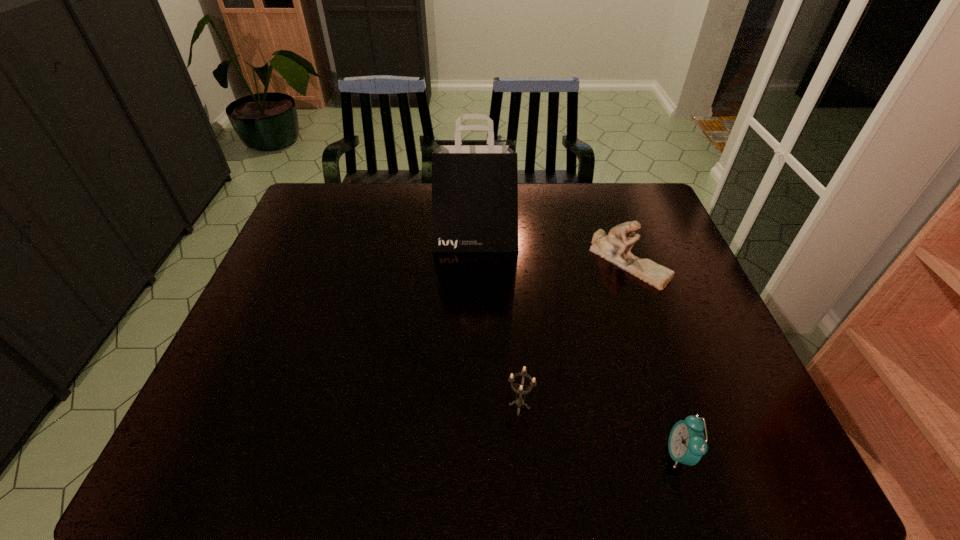
Locate an element on the screen. object located at the near edge is located at coordinates (687, 444).

Find the location of a particular element. This screenshot has height=540, width=960. object present at the right edge is located at coordinates (615, 247).

What are the coordinates of `free region at the far edge` in the screenshot? It's located at (362, 197).

The image size is (960, 540). I want to click on free space at the near edge, so click(x=361, y=467).

The width and height of the screenshot is (960, 540). In the image, there is a desktop. In order to click on vacant space at the left edge in this screenshot , I will do `click(261, 407)`.

Find the location of a particular element. vacant space at the right edge of the desktop is located at coordinates (668, 362).

Identify the location of vacant region at the near right corner of the desktop. Image resolution: width=960 pixels, height=540 pixels. (753, 454).

This screenshot has height=540, width=960. What are the coordinates of `empty location between the figurine and the shopping bag` in the screenshot? It's located at (552, 251).

Where is `empty location between the candle holder and the third shortest object`? This screenshot has height=540, width=960. empty location between the candle holder and the third shortest object is located at coordinates (574, 334).

In order to click on free space between the nearest object and the second nearest object in this screenshot , I will do `click(600, 430)`.